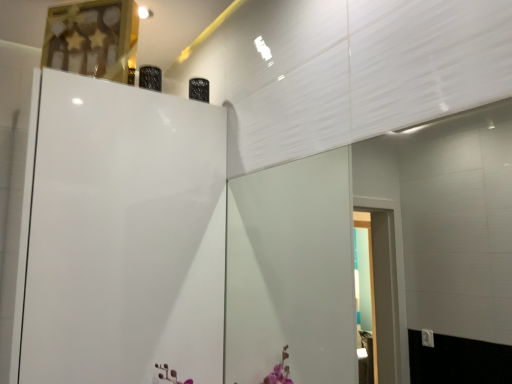
Question: Should I look upward or downward to see white glossy door at upper left?

Choices:
 (A) down
 (B) up

Answer: (A)